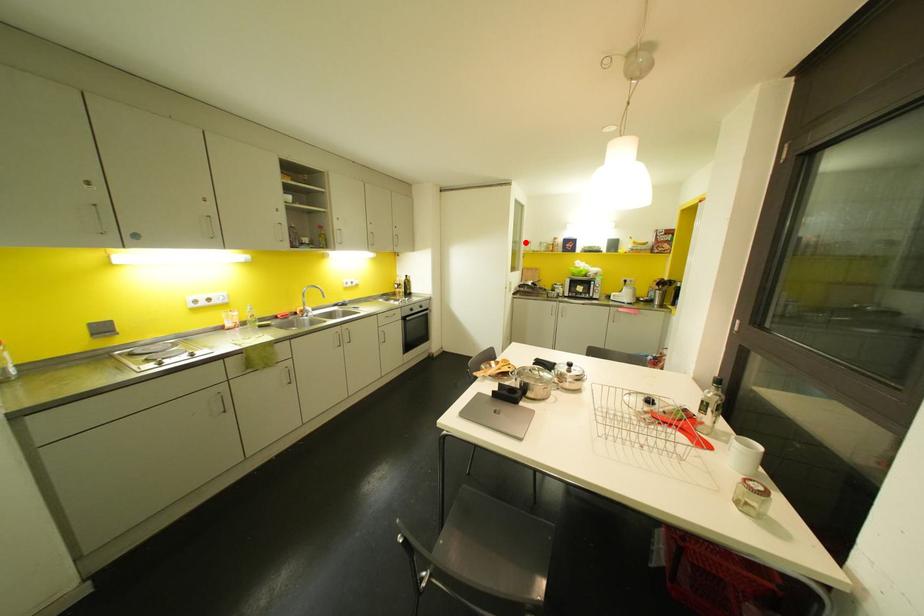
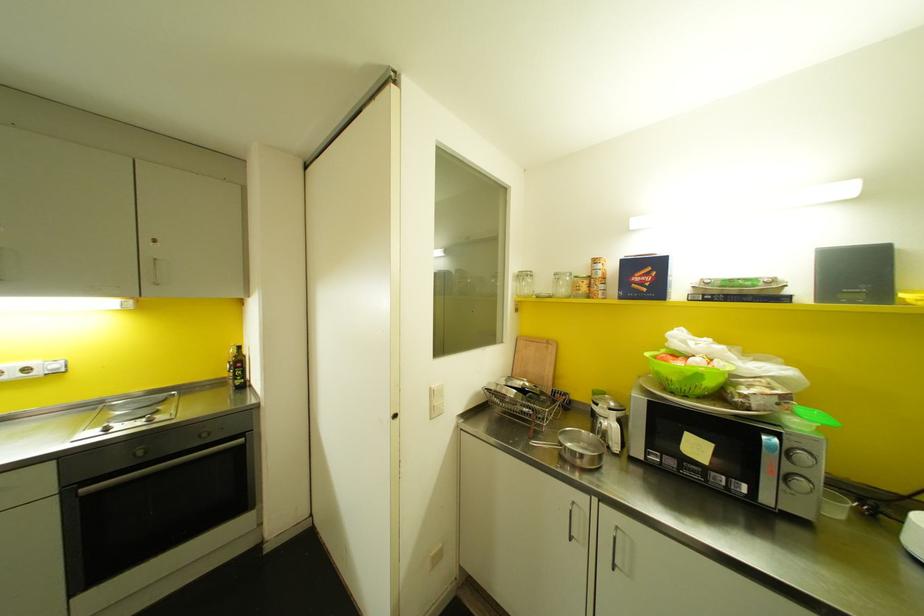
Locate, in the second image, the point that corresponds to the highlighted location in the first image.

(520, 276)